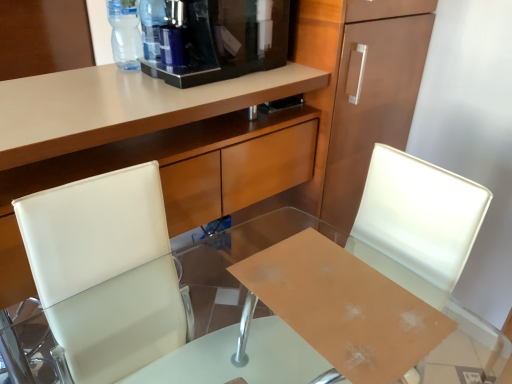
Question: Should I look upward or downward to see white leather swivel chair at center?

Choices:
 (A) down
 (B) up

Answer: (A)

Question: Should I look upward or downward to see matte wood cabinet at upper center?

Choices:
 (A) down
 (B) up

Answer: (A)

Question: From the image's perspective, does transparent plastic bottle at upper center, marked as the second bottle in a right-to-left arrangement, appear lower than transparent glass desk at center?

Choices:
 (A) yes
 (B) no

Answer: (B)

Question: Is transparent plastic bottle at upper center, marked as the second bottle in a right-to-left arrangement, bigger than transparent glass desk at center?

Choices:
 (A) yes
 (B) no

Answer: (B)

Question: Is transparent plastic bottle at upper center, the first bottle viewed from the left, smaller than transparent glass desk at center?

Choices:
 (A) no
 (B) yes

Answer: (B)

Question: Could you tell me if transparent plastic bottle at upper center, the first bottle viewed from the left, is turned towards transparent glass desk at center?

Choices:
 (A) yes
 (B) no

Answer: (B)

Question: Can you confirm if transparent plastic bottle at upper center, marked as the second bottle in a right-to-left arrangement, is thinner than transparent glass desk at center?

Choices:
 (A) no
 (B) yes

Answer: (B)

Question: Could transparent glass desk at center be considered to be inside transparent plastic bottle at upper center, the first bottle viewed from the left?

Choices:
 (A) no
 (B) yes

Answer: (A)

Question: Is white leather swivel chair at center at the right side of transparent plastic bottle at upper center, positioned as the second bottle in left-to-right order?

Choices:
 (A) yes
 (B) no

Answer: (A)

Question: Does white leather swivel chair at center have a larger size compared to transparent plastic bottle at upper center, positioned as the second bottle in left-to-right order?

Choices:
 (A) yes
 (B) no

Answer: (A)

Question: Is white leather swivel chair at center shorter than transparent plastic bottle at upper center, placed as the 1th bottle when sorted from right to left?

Choices:
 (A) no
 (B) yes

Answer: (A)

Question: Considering the relative sizes of white leather swivel chair at center and transparent plastic bottle at upper center, placed as the 1th bottle when sorted from right to left, in the image provided, is white leather swivel chair at center smaller than transparent plastic bottle at upper center, placed as the 1th bottle when sorted from right to left,?

Choices:
 (A) yes
 (B) no

Answer: (B)

Question: Is white leather swivel chair at center oriented away from transparent plastic bottle at upper center, positioned as the second bottle in left-to-right order?

Choices:
 (A) no
 (B) yes

Answer: (A)

Question: Is white leather swivel chair at center closer to camera compared to transparent plastic bottle at upper center, placed as the 1th bottle when sorted from right to left?

Choices:
 (A) yes
 (B) no

Answer: (A)

Question: Is the position of white leather chair at center more distant than that of transparent plastic bottle at upper center, the first bottle viewed from the left?

Choices:
 (A) yes
 (B) no

Answer: (B)